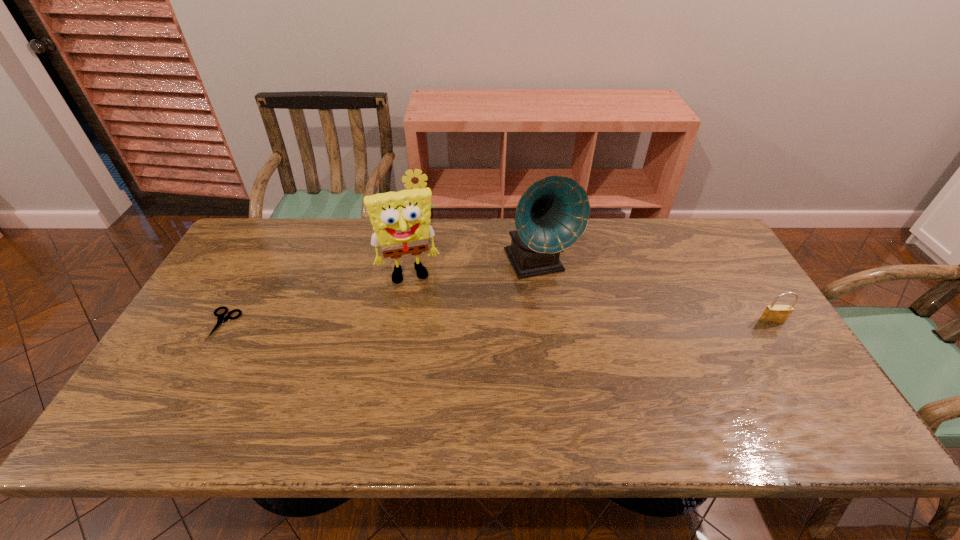
I want to click on object that is the closest one to the second tallest object, so click(418, 179).

Locate an element on the screen. Image resolution: width=960 pixels, height=540 pixels. vacant space that satisfies the following two spatial constraints: 1. on the back side of the shears; 2. on the right side of the fourth shortest object is located at coordinates (251, 274).